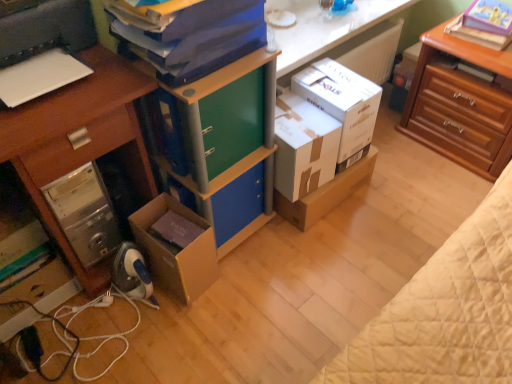
Question: Is white glossy counter top at upper center taller or shorter than cardboard box at lower left, acting as the 3th box starting from the right?

Choices:
 (A) tall
 (B) short

Answer: (B)

Question: From a real-world perspective, relative to cardboard box at lower left, acting as the 3th box starting from the right, is white glossy counter top at upper center vertically above or below?

Choices:
 (A) above
 (B) below

Answer: (A)

Question: Which of these objects is positioned farthest from the white plastic printer at left?

Choices:
 (A) wooden desk at left
 (B) white cardboard box at center, the 2th box from the left
 (C) white cardboard box at center
 (D) white glossy counter top at upper center
 (E) cardboard box at lower left, acting as the 1th box starting from the left

Answer: (C)

Question: Estimate the real-world distances between objects in this image. Which object is closer to the blue matte bookshelf at center?

Choices:
 (A) cardboard box at lower left, acting as the 3th box starting from the right
 (B) white cardboard box at center, the 2th box from the left
 (C) white cardboard box at center
 (D) white cardboard box at center, which is counted as the third box, starting from the left
 (E) wooden desk at left

Answer: (B)